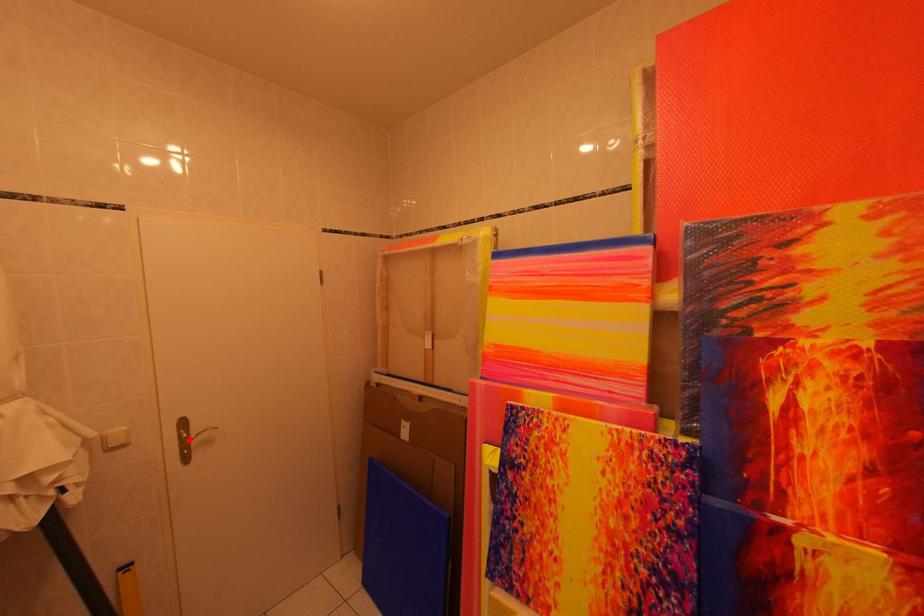
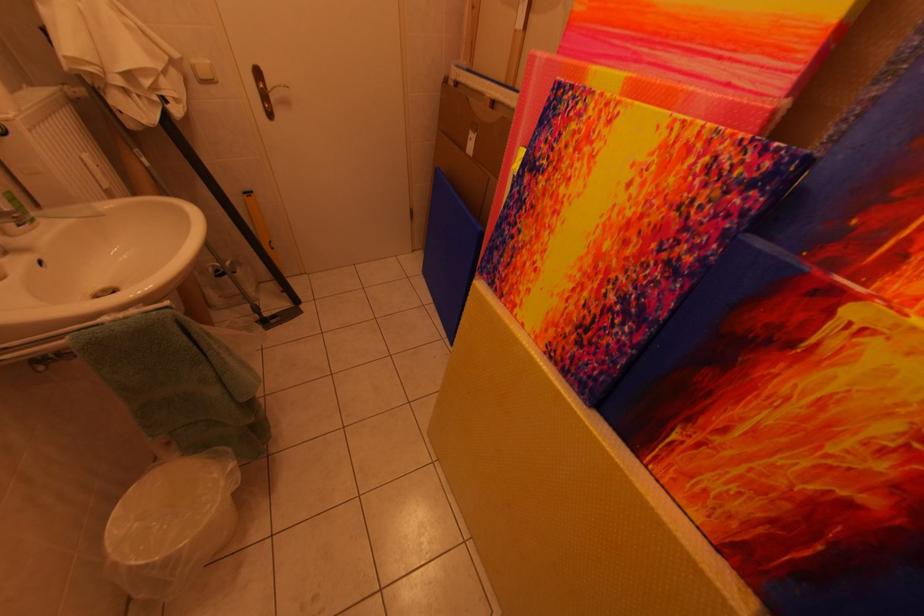
The point at the highlighted location is marked in the first image. Where is the corresponding point in the second image?

(268, 91)